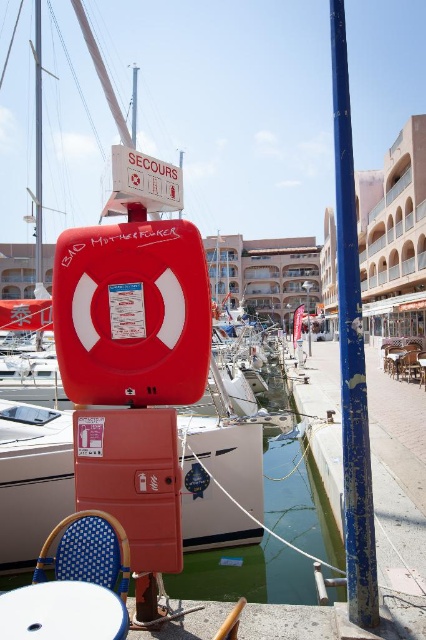
You are a guest at a marina event and need to sit down at the wooden table at center. Which direction should you walk from the brown woven chair at lower right to reach the table?

The brown woven chair at lower right is above the wooden table at center, so you should walk downward from the brown woven chair at lower right to reach the wooden table at center.

You are standing at the edge of the marina and want to place a small floating marker at the exact location where the transparent plastic water at lower center is located. According to the coordinates provided, where should you place the marker?

The transparent plastic water at lower center is located at coordinates point (x=299, y=499), so you should place the marker there.

Consider the image. You are a person sitting on the brown woven chair at lower right and want to reach the wooden table at center to grab a drink. Considering the distance between them, can you comfortably stretch your arm to reach the table without moving from the chair?

The brown woven chair at lower right is 13.74 inches from the wooden table at center. Since this distance is within typical arm reach for most adults, you can comfortably stretch your arm to reach the table without moving from the chair.